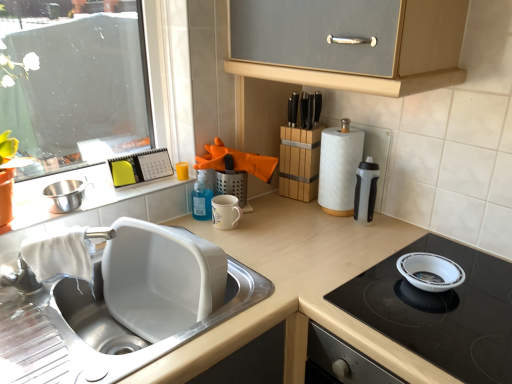
Where is `free point above white glossy bowl at upper right (from a real-world perspective)`? This screenshot has width=512, height=384. free point above white glossy bowl at upper right (from a real-world perspective) is located at coordinates (435, 307).